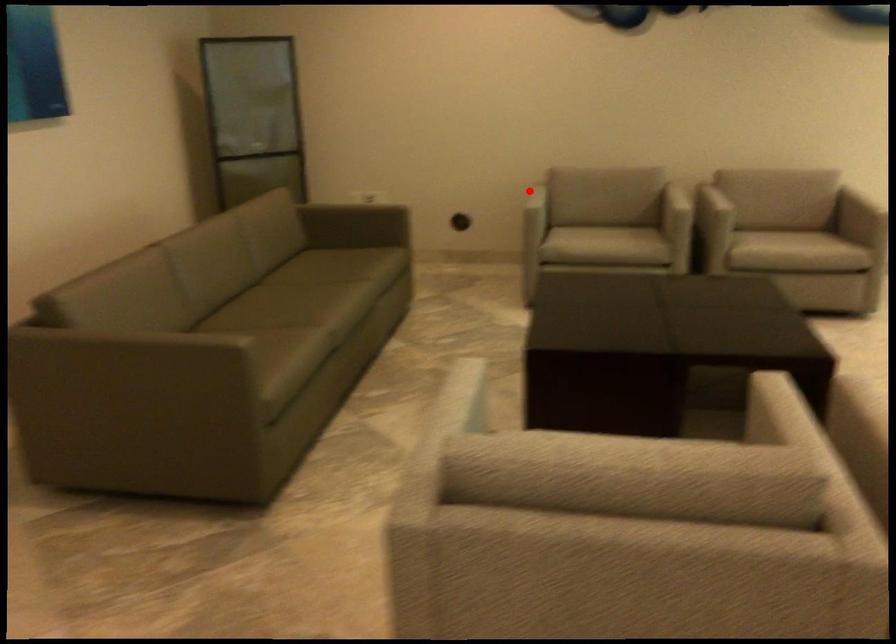
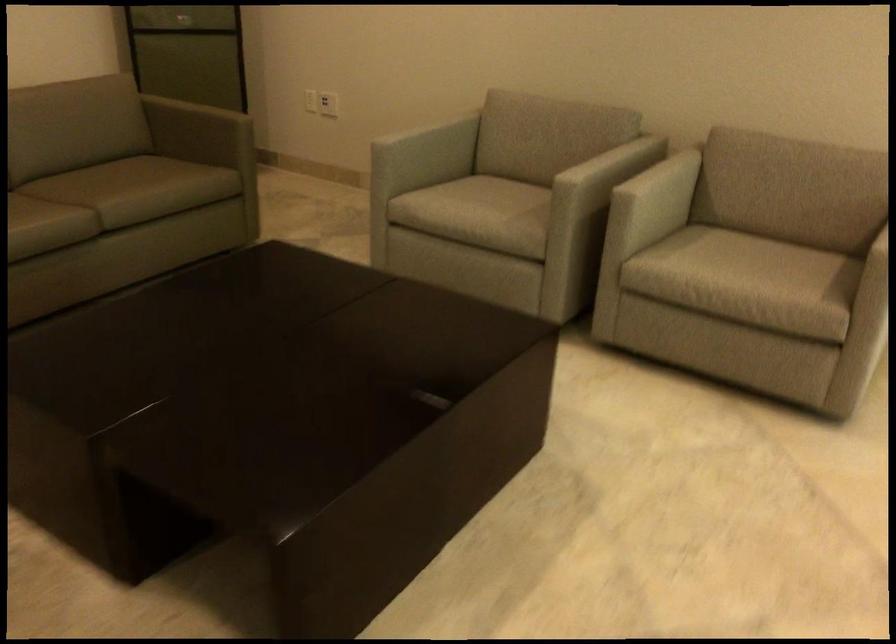
Question: I am providing you with two images of the same scene from different viewpoints. Image1 has a red point marked. In image2, the corresponding 3D location appears at what relative position? Reply with the corresponding letter.

Choices:
 (A) Closer
 (B) Farther

Answer: (A)